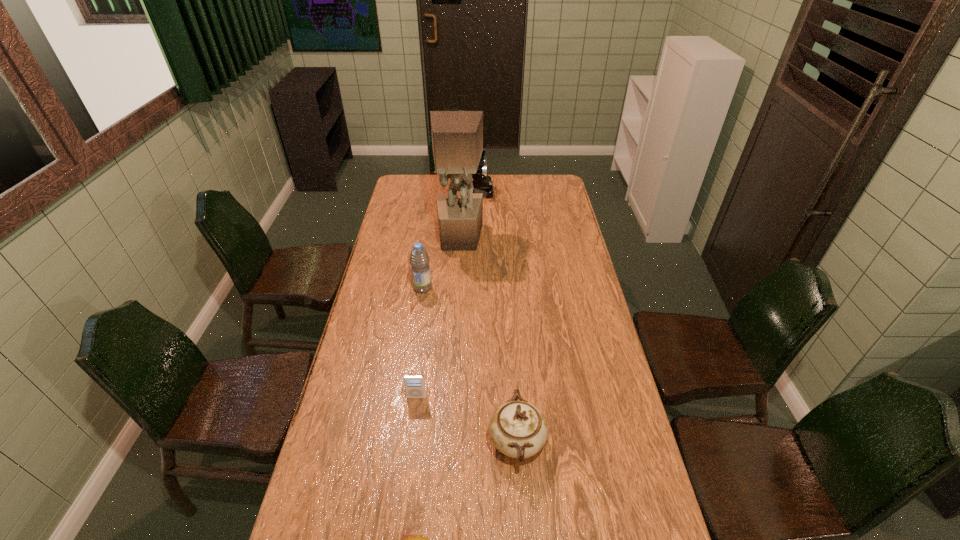
This screenshot has width=960, height=540. In order to click on the tallest object in this screenshot , I will do (x=457, y=136).

Identify the location of sculpture. The height and width of the screenshot is (540, 960). (457, 136).

Where is `the farthest object`? The width and height of the screenshot is (960, 540). the farthest object is located at coordinates (482, 183).

Identify the location of camcorder. (482, 183).

Identify the location of water bottle. The width and height of the screenshot is (960, 540). (419, 259).

I want to click on the fourth nearest object, so click(x=419, y=259).

The width and height of the screenshot is (960, 540). I want to click on the fifth farthest object, so tap(518, 429).

The height and width of the screenshot is (540, 960). Find the location of `chinaware`. chinaware is located at coordinates (518, 429).

Locate an element on the screen. Image resolution: width=960 pixels, height=540 pixels. iPod is located at coordinates (414, 385).

Identify the location of vacant space positioned on the front-facing side of the tallest object. (456, 301).